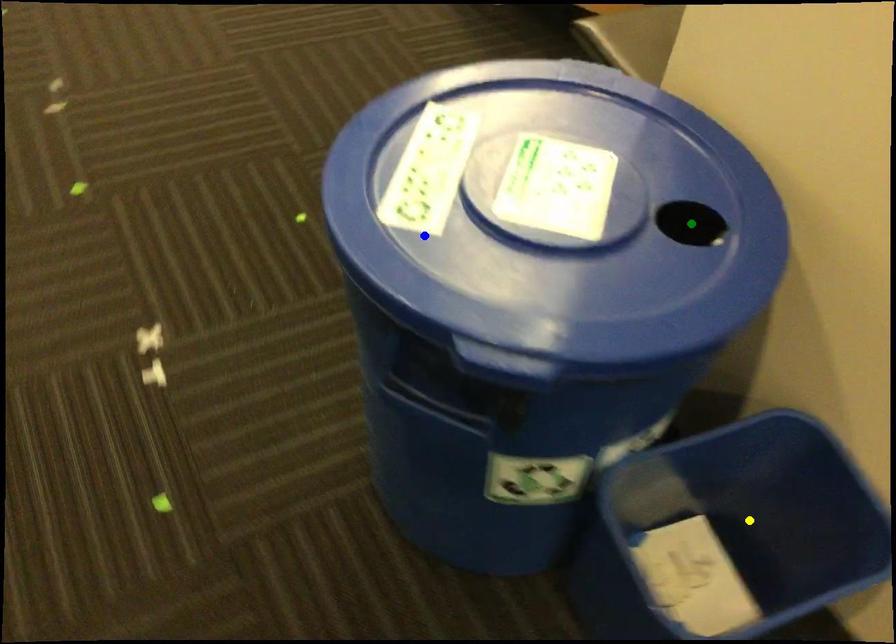
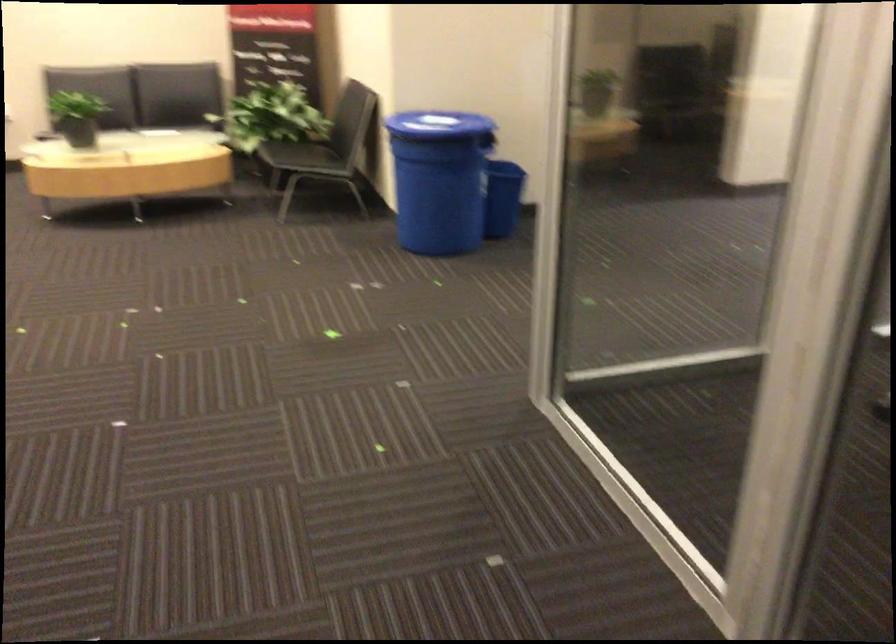
I am providing you with two images of the same scene from different viewpoints. Three points are marked in image1. Which point corresponds to a part or object that is occluded in image2?In image1, three points are marked. Which of them correspond to a part or object that is occluded in image2?Among the three points shown in image1, which one corresponds to a part or object that is no longer visible due to occlusion in image2?

Invisible in image2: green point, yellow point.